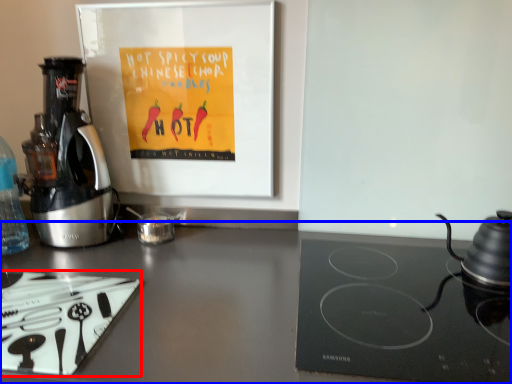
Question: Which point is closer to the camera, kitchen appliance (highlighted by a red box) or counter top (highlighted by a blue box)?

Choices:
 (A) kitchen appliance
 (B) counter top

Answer: (B)